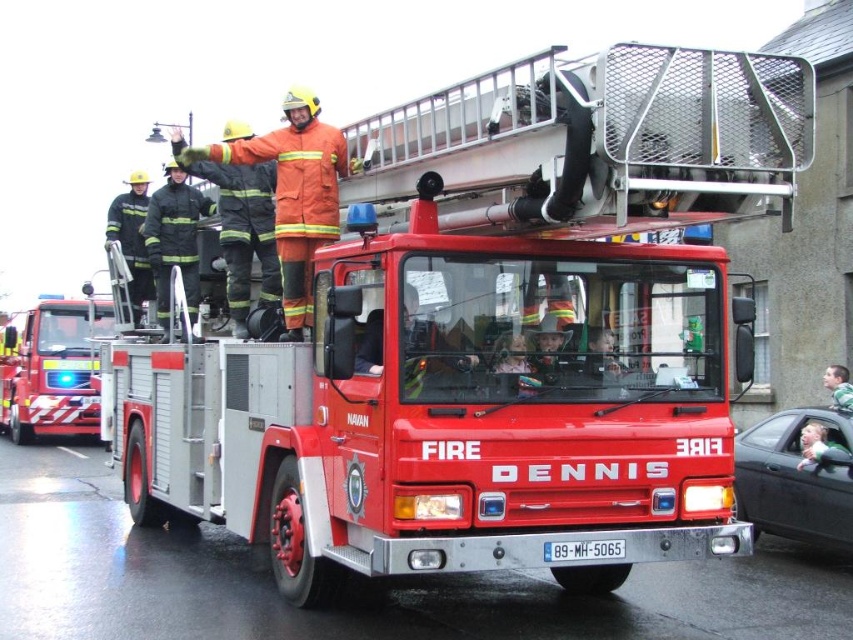
Is shiny red fire truck at left further to camera compared to green fabric shirt at center?

Yes, shiny red fire truck at left is behind green fabric shirt at center.

Can you confirm if shiny red fire truck at left is positioned to the left of green fabric shirt at center?

Indeed, shiny red fire truck at left is positioned on the left side of green fabric shirt at center.

I want to click on shiny red fire truck at left, so click(x=51, y=369).

Who is higher up, reflective black uniform at left or white plastic license plate at center?

reflective black uniform at left is above.

Does reflective black uniform at left come in front of white plastic license plate at center?

No, reflective black uniform at left is behind white plastic license plate at center.

Between point (149, 291) and point (558, 541), which one is positioned in front?

Point (558, 541) is in front.

I want to click on reflective black uniform at left, so click(132, 240).

Where is `black fabric fireman at center`? The height and width of the screenshot is (640, 853). black fabric fireman at center is located at coordinates (173, 240).

Who is taller, black fabric fireman at center or white plastic license plate at center?

With more height is black fabric fireman at center.

Find the location of `black fabric fireman at center`. black fabric fireman at center is located at coordinates (173, 240).